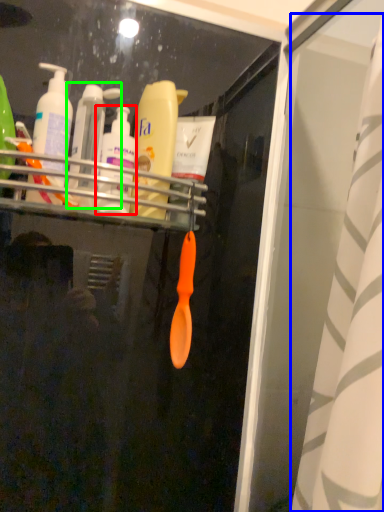
Question: Which object is the farthest from toiletry (highlighted by a red box)? Choose among these: shower curtain (highlighted by a blue box) or toiletry (highlighted by a green box).

Choices:
 (A) shower curtain
 (B) toiletry

Answer: (A)